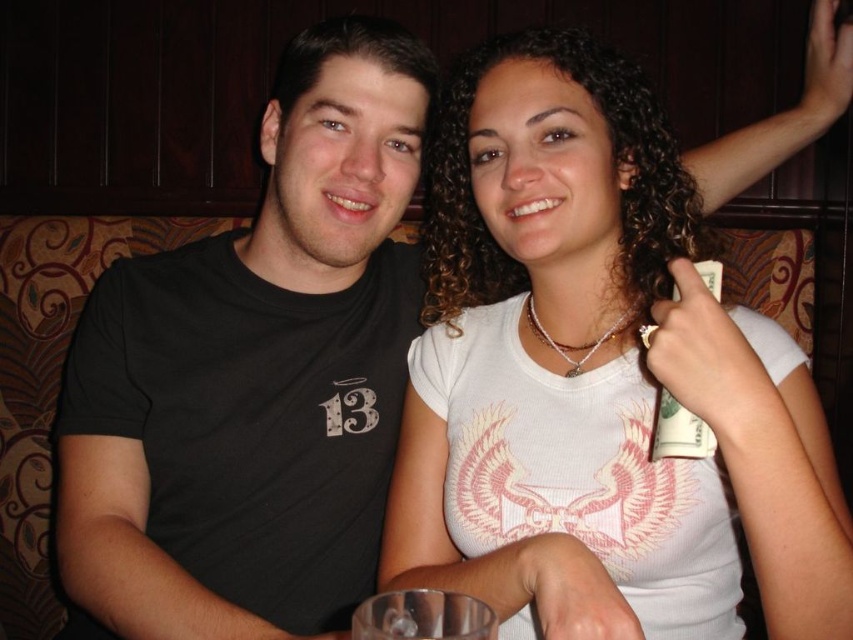
You are a photographer trying to capture a closeup of the white matte shirt at upper right. Based on the scene, where should you position yourself relative to the two people in the image to ensure the shirt is in the frame?

The white matte shirt at upper right is located at point (595, 364), so you should position yourself to the upper right of the two people to capture the shirt in the frame.

Based on the scene description, where is the white matte shirt at upper right located in terms of coordinates?

The white matte shirt at upper right is located at coordinates point (595, 364).